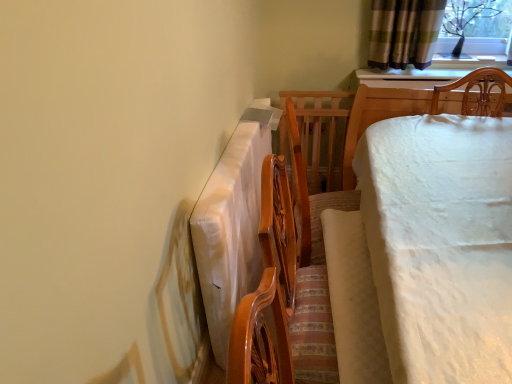
Question: Considering the relative positions of clear glass window screen at upper right and light beige fabric at center in the image provided, is clear glass window screen at upper right to the left of light beige fabric at center from the viewer's perspective?

Choices:
 (A) yes
 (B) no

Answer: (B)

Question: Can you confirm if clear glass window screen at upper right is positioned to the right of light beige fabric at center?

Choices:
 (A) no
 (B) yes

Answer: (B)

Question: Is light beige fabric at center located within clear glass window screen at upper right?

Choices:
 (A) yes
 (B) no

Answer: (B)

Question: Is clear glass window screen at upper right positioned far away from light beige fabric at center?

Choices:
 (A) no
 (B) yes

Answer: (B)

Question: Can you confirm if clear glass window screen at upper right is bigger than light beige fabric at center?

Choices:
 (A) yes
 (B) no

Answer: (A)

Question: From a real-world perspective, is white fabric-covered bed at right physically located above or below white plastic tablecloth at center?

Choices:
 (A) below
 (B) above

Answer: (B)

Question: Considering the positions of white fabric-covered bed at right and white plastic tablecloth at center in the image, is white fabric-covered bed at right wider or thinner than white plastic tablecloth at center?

Choices:
 (A) thin
 (B) wide

Answer: (B)

Question: In the image, is white fabric-covered bed at right on the left side or the right side of white plastic tablecloth at center?

Choices:
 (A) left
 (B) right

Answer: (B)

Question: From the image's perspective, is white fabric-covered bed at right positioned above or below white plastic tablecloth at center?

Choices:
 (A) above
 (B) below

Answer: (B)

Question: From a real-world perspective, relative to light beige fabric at center, is clear glass window screen at upper right vertically above or below?

Choices:
 (A) below
 (B) above

Answer: (B)

Question: Based on their sizes in the image, would you say clear glass window screen at upper right is bigger or smaller than light beige fabric at center?

Choices:
 (A) big
 (B) small

Answer: (A)

Question: From the image's perspective, is clear glass window screen at upper right positioned above or below light beige fabric at center?

Choices:
 (A) above
 (B) below

Answer: (A)

Question: Considering the positions of clear glass window screen at upper right and light beige fabric at center in the image, is clear glass window screen at upper right taller or shorter than light beige fabric at center?

Choices:
 (A) tall
 (B) short

Answer: (A)

Question: From the image's perspective, is clear glass window screen at upper right positioned above or below white fabric-covered bed at right?

Choices:
 (A) below
 (B) above

Answer: (B)

Question: Considering the positions of clear glass window screen at upper right and white fabric-covered bed at right in the image, is clear glass window screen at upper right taller or shorter than white fabric-covered bed at right?

Choices:
 (A) tall
 (B) short

Answer: (B)